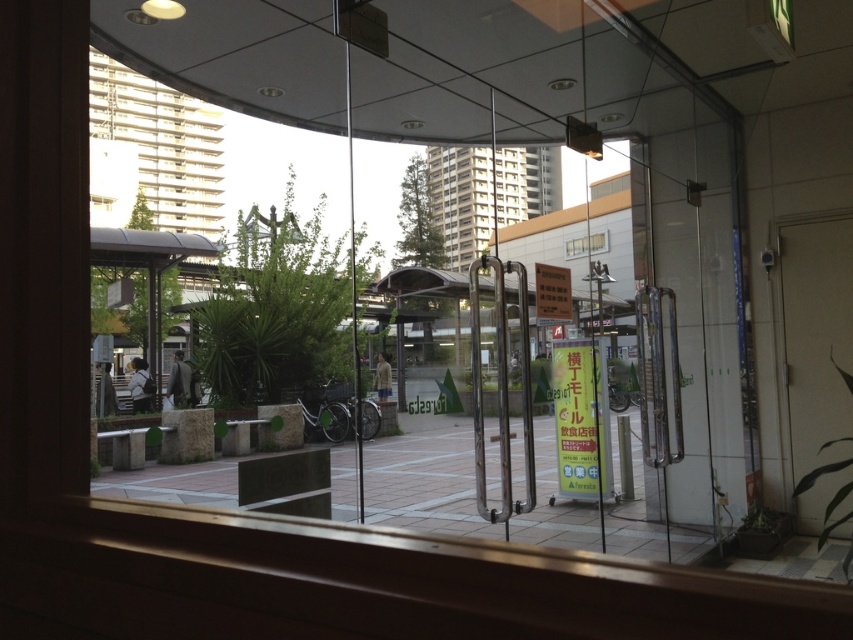
Based on the photo, does transparent glass window at center have a smaller size compared to clear glass window at center?

No, transparent glass window at center is not smaller than clear glass window at center.

Is transparent glass window at center above clear glass window at center?

Yes, transparent glass window at center is above clear glass window at center.

Who is more distant from viewer, (527, 189) or (585, 237)?

The point (527, 189) is behind.

I want to click on transparent glass window at center, so click(486, 193).

Does transparent glass door at center have a greater width compared to transparent glass window at upper left?

No, transparent glass door at center is not wider than transparent glass window at upper left.

Between transparent glass door at center and transparent glass window at upper left, which one is positioned higher?

transparent glass window at upper left

Is point (282, 65) closer to viewer compared to point (151, 148)?

Yes, point (282, 65) is closer to viewer.

Image resolution: width=853 pixels, height=640 pixels. I want to click on transparent glass door at center, so click(x=525, y=141).

Looking at this image, measure the distance from transparent glass door at center to transparent glass window at center.

A distance of 22.20 meters exists between transparent glass door at center and transparent glass window at center.

Who is more distant from viewer, (x=294, y=122) or (x=500, y=227)?

The point (x=500, y=227) is more distant.

Is point (397, 93) farther from camera compared to point (537, 186)?

No, (397, 93) is closer to viewer.

The width and height of the screenshot is (853, 640). What are the coordinates of `transparent glass door at center` in the screenshot? It's located at click(525, 141).